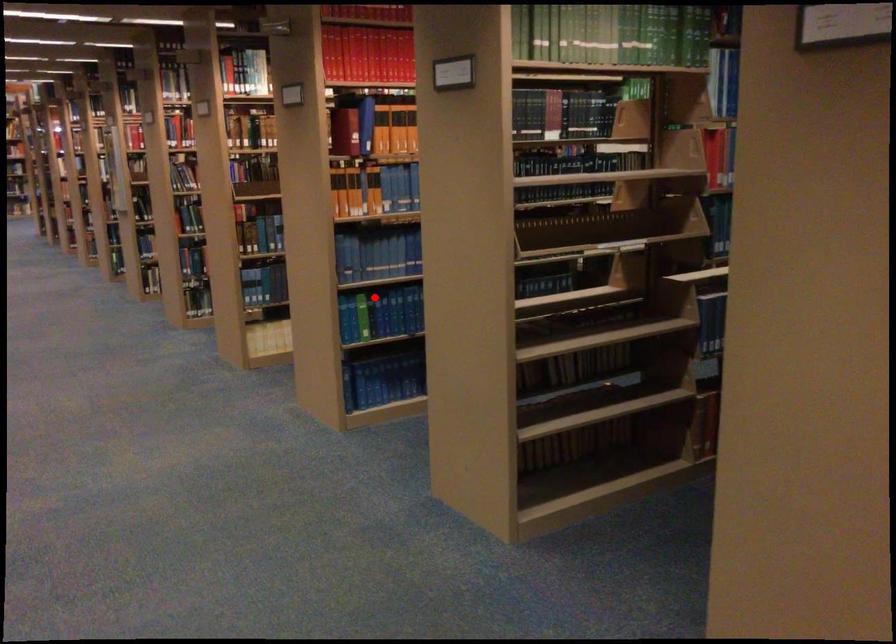
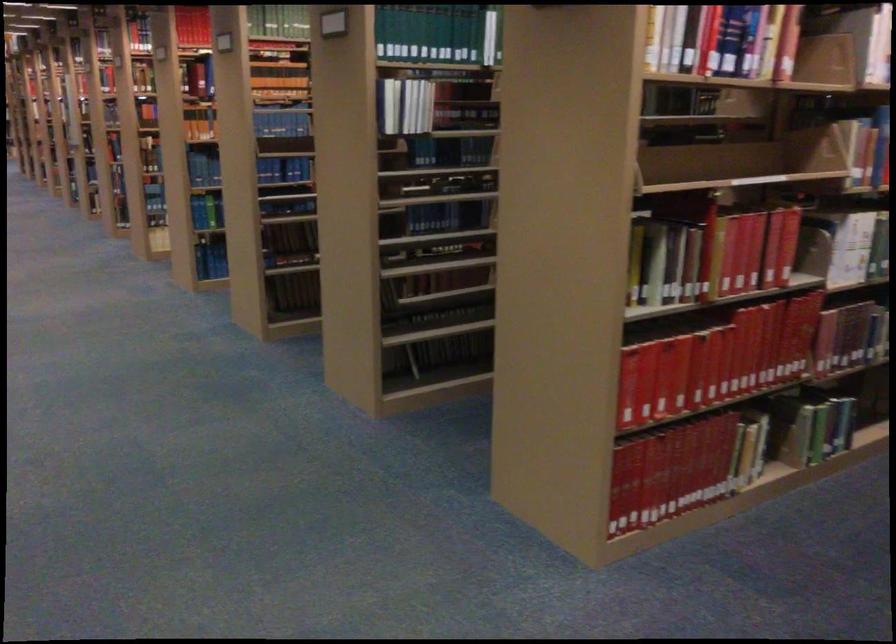
Question: I am providing you with two images of the same scene from different viewpoints. A red point is shown in image1. For the corresponding object point in image2, is it positioned nearer or farther from the camera?

Choices:
 (A) Nearer
 (B) Farther

Answer: (B)